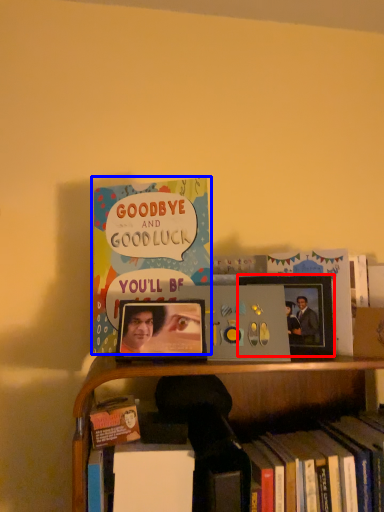
Question: Among these objects, which one is farthest to the camera, picture frame (highlighted by a red box) or book (highlighted by a blue box)?

Choices:
 (A) picture frame
 (B) book

Answer: (A)